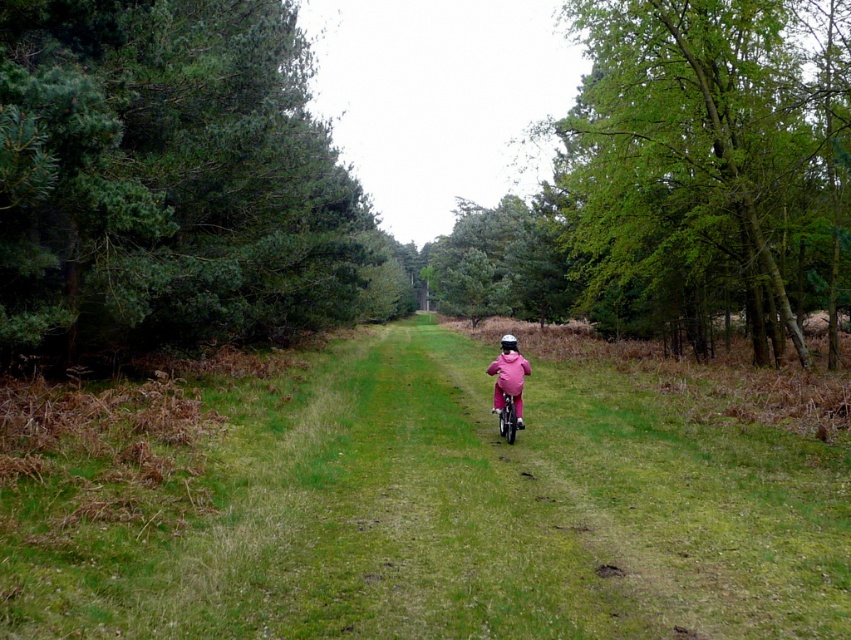
Question: Is green leafy tree at right wider than pink matte jacket at center?

Choices:
 (A) no
 (B) yes

Answer: (B)

Question: Is pink matte jacket at center wider than pink matte bicycle at center?

Choices:
 (A) yes
 (B) no

Answer: (A)

Question: Does green textured pine trees at left appear on the left side of pink matte jacket at center?

Choices:
 (A) no
 (B) yes

Answer: (B)

Question: Estimate the real-world distances between objects in this image. Which object is farther from the pink matte jacket at center?

Choices:
 (A) green textured pine trees at left
 (B) pink matte bicycle at center
 (C) green leafy tree at right

Answer: (A)

Question: Which point is closer to the camera taking this photo?

Choices:
 (A) (495, 394)
 (B) (842, 156)
 (C) (520, 403)

Answer: (C)

Question: Which is farther from the green textured pine trees at left?

Choices:
 (A) pink matte jacket at center
 (B) green leafy tree at right

Answer: (A)